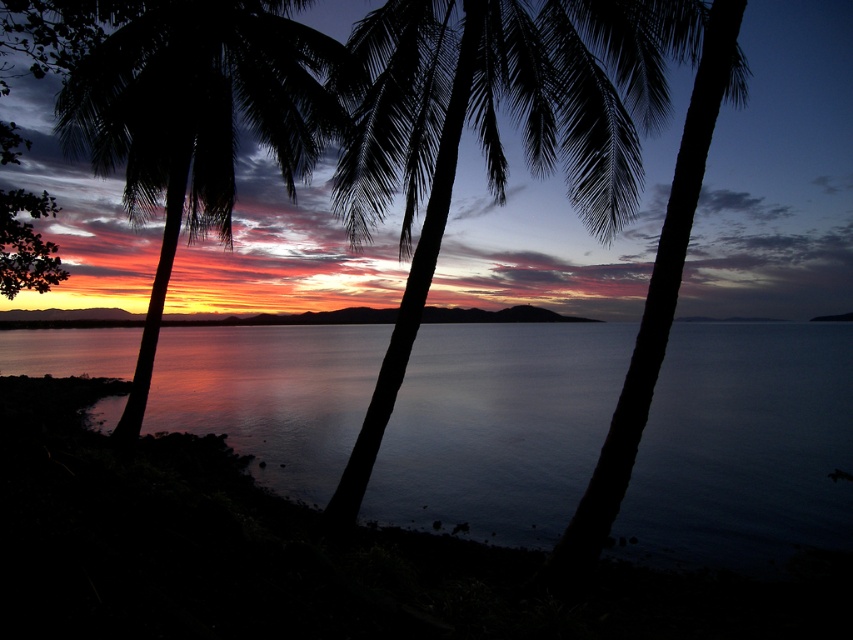
Question: Among these points, which one is farthest from the camera?

Choices:
 (A) (120, 132)
 (B) (428, 506)
 (C) (482, 141)

Answer: (A)

Question: Which of these objects is positioned closest to the silhouette palm tree at left?

Choices:
 (A) black leafy palm tree at center
 (B) silvery reflective water at center

Answer: (A)

Question: Which point is farther to the camera?

Choices:
 (A) silvery reflective water at center
 (B) black leafy palm tree at center

Answer: (A)

Question: Is silvery reflective water at center further to the viewer compared to black leafy palm tree at center?

Choices:
 (A) yes
 (B) no

Answer: (A)

Question: Observing the image, what is the correct spatial positioning of black leafy palm tree at center in reference to silhouette palm tree at left?

Choices:
 (A) below
 (B) above

Answer: (B)

Question: Can you confirm if silvery reflective water at center is positioned to the left of black leafy palm tree at center?

Choices:
 (A) yes
 (B) no

Answer: (A)